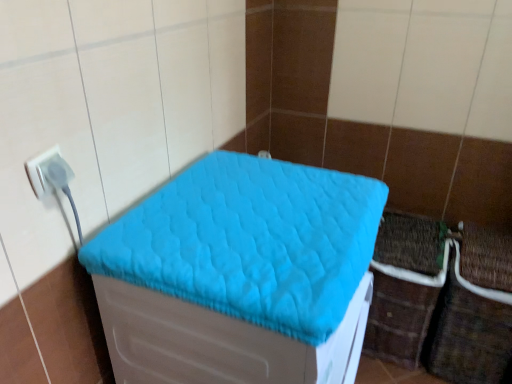
Question: From the image's perspective, is white plastic plug at left located above or below turquoise quilted cushion at center?

Choices:
 (A) above
 (B) below

Answer: (A)

Question: Relative to turquoise quilted cushion at center, is white plastic plug at left in front or behind?

Choices:
 (A) behind
 (B) front

Answer: (A)

Question: Based on their relative distances, which object is nearer to the white plastic plug at left?

Choices:
 (A) turquoise quilted cushion at center
 (B) brown woven crate at lower right

Answer: (A)

Question: Which object is the closest to the brown woven crate at lower right?

Choices:
 (A) white plastic plug at left
 (B) turquoise quilted cushion at center

Answer: (B)